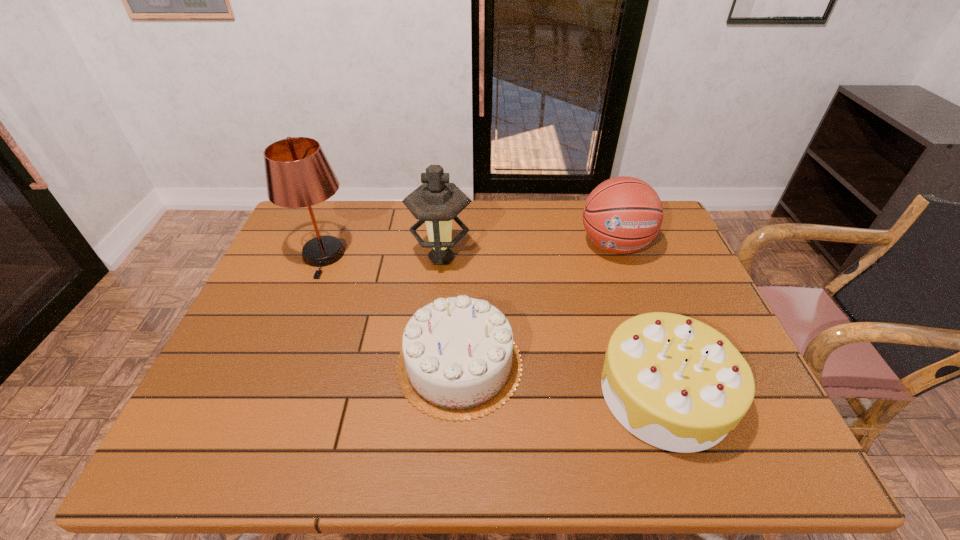
At what (x,y) coordinates should I click in order to perform the action: click on the tallest object. Please return your answer as a coordinate pair (x, y). Looking at the image, I should click on (298, 174).

The height and width of the screenshot is (540, 960). Find the location of `lampshade`. lampshade is located at coordinates click(298, 174).

Where is `oil lamp`? oil lamp is located at coordinates (436, 202).

Find the location of a particular element. The height and width of the screenshot is (540, 960). basketball is located at coordinates (623, 214).

At what (x,y) coordinates should I click in order to perform the action: click on the right birthday cake. Please return your answer as a coordinate pair (x, y). This screenshot has width=960, height=540. Looking at the image, I should click on (676, 383).

This screenshot has height=540, width=960. Identify the location of the left birthday cake. (458, 362).

Locate an element on the screen. The width and height of the screenshot is (960, 540). free location located on the front-facing side of the lampshade is located at coordinates (292, 334).

You are a GUI agent. You are given a task and a screenshot of the screen. Output one action in this format:
    pyautogui.click(x=<x>, y=<y>)
    Task: Click on the vacant position located on the left of the oil lamp
    Image resolution: width=960 pixels, height=540 pixels.
    Given the screenshot: What is the action you would take?
    pyautogui.click(x=363, y=258)

I want to click on vacant space located 0.230m on the logo side of the third shortest object, so click(x=644, y=330).

You are a GUI agent. You are given a task and a screenshot of the screen. Output one action in this format:
    pyautogui.click(x=<x>, y=<y>)
    Task: Click on the vacant area located on the left of the right birthday cake
    This screenshot has width=960, height=540.
    Given the screenshot: What is the action you would take?
    pyautogui.click(x=479, y=393)